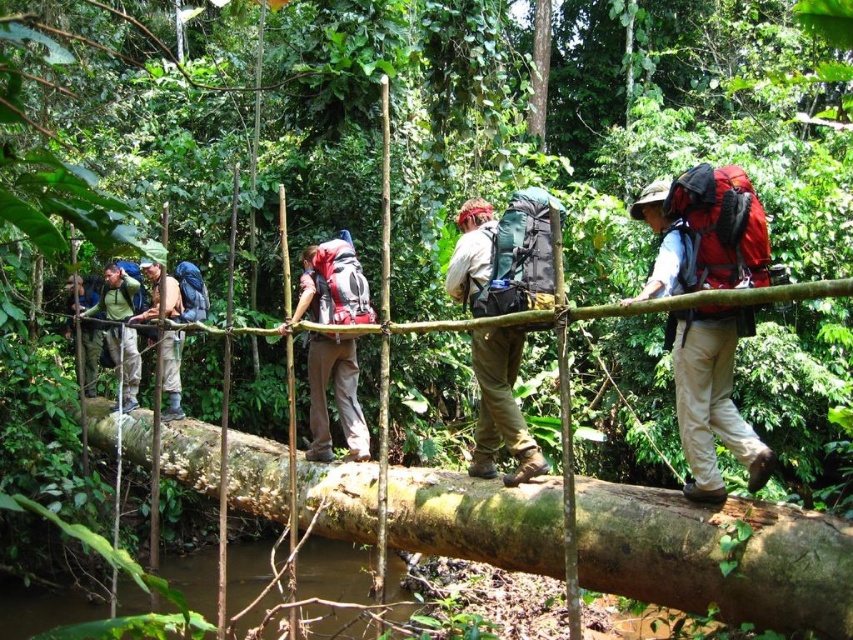
You are a hiker standing on the bridge and want to check the visibility of your gear. Which item is closer to you between the matte red backpack at center and the matte khaki pants at center?

The matte red backpack at center is closer to you than the matte khaki pants at center.

You are a hiker standing on the bridge and want to reach a point on the bridge. The bridge has two points marked as point A at coordinates point A is point (485,371) and point B at coordinates point B is point (321,372). Which point is closer to you if you are facing the direction of the bridge?

Point A at coordinates point A is point (485,371) is closer to you because it is nearer to the camera compared to point B at coordinates point B is point (321,372).

You are a hiker planning to cross the bridge and need to know if your backpack will fit under a low hanging branch. Given the information about the matte green backpack at left and matte khaki pants at center, which object is shorter in height?

The matte green backpack at left has a lesser height compared to matte khaki pants at center, so the backpack is shorter and should fit under the branch.